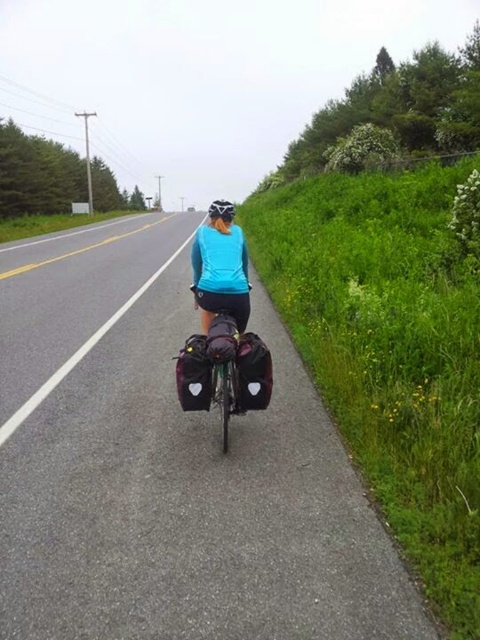
Looking at this image, you are a cyclist looking at the road ahead. You see the asphalt road at center and the black matte bicycle helmet at upper center. Which object is positioned to the left of the other?

The asphalt road at center is to the left of the black matte bicycle helmet at upper center.

You are a delivery cyclist who needs to deliver a package to a location marked at point coordinates of 0.731, 0.350. You are currently on the asphalt road at center. Based on the image, can you confirm if you are already at the delivery location?

The position of asphalt road at center is at point (168, 467), so yes, you are already at the delivery location marked at those coordinates.

Looking at this image, you are a photographer standing at the edge of the road capturing the cyclist. You notice two points marked in the image. Which point, point (233, 301) or point (215, 216), is closer to your camera?

Point (233, 301) is closer to the camera than point (215, 216).